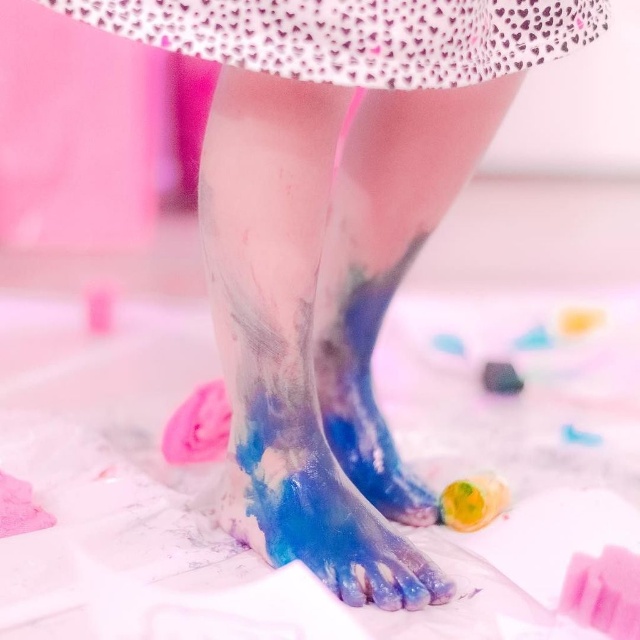
Question: Is shiny blue paint at lower center bigger than blue glossy foot at center?

Choices:
 (A) no
 (B) yes

Answer: (B)

Question: Does white dotted fabric at upper center have a smaller size compared to shiny blue paint at lower center?

Choices:
 (A) yes
 (B) no

Answer: (B)

Question: Which of the following is the closest to the observer?

Choices:
 (A) white dotted fabric at upper center
 (B) shiny blue paint at lower center
 (C) blue glossy foot at center

Answer: (A)

Question: Observing the image, what is the correct spatial positioning of white dotted fabric at upper center in reference to blue glossy foot at center?

Choices:
 (A) right
 (B) left

Answer: (B)

Question: Which point appears farthest from the camera in this image?

Choices:
 (A) (332, 280)
 (B) (262, 42)

Answer: (A)

Question: Which point appears closest to the camera in this image?

Choices:
 (A) (280, 508)
 (B) (124, 16)

Answer: (B)